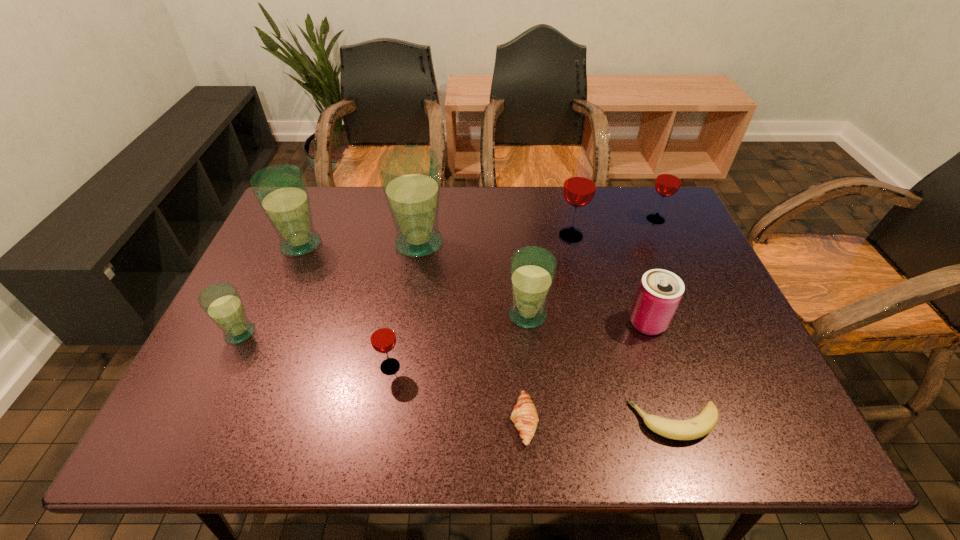
The width and height of the screenshot is (960, 540). Identify the location of vacant space at the right edge of the desktop. (695, 288).

You are a GUI agent. You are given a task and a screenshot of the screen. Output one action in this format:
    pyautogui.click(x=<x>, y=<y>)
    Task: Click on the free point between the pastry and the third glass from right to left
    
    Given the screenshot: What is the action you would take?
    pyautogui.click(x=526, y=368)

This screenshot has width=960, height=540. What are the coordinates of `empty space between the pastry and the can` in the screenshot? It's located at (586, 372).

This screenshot has width=960, height=540. What are the coordinates of `vacant space in between the second glass from right to left and the shortest object` in the screenshot? It's located at (623, 328).

Where is `free point between the pastry and the third smallest blue glass`? free point between the pastry and the third smallest blue glass is located at coordinates (413, 333).

Locate an element on the screen. The image size is (960, 540). empty space between the pink can and the pastry is located at coordinates (586, 372).

The width and height of the screenshot is (960, 540). In order to click on vacant area that lies between the second biggest blue glass and the smallest blue glass in this screenshot , I will do `click(271, 288)`.

Image resolution: width=960 pixels, height=540 pixels. I want to click on free area in between the smallest blue glass and the pastry, so click(382, 377).

Where is `free space between the pastry and the yellow banana`? The width and height of the screenshot is (960, 540). free space between the pastry and the yellow banana is located at coordinates (599, 421).

Where is `free space between the second blue glass from right to left and the banana`? free space between the second blue glass from right to left and the banana is located at coordinates (547, 332).